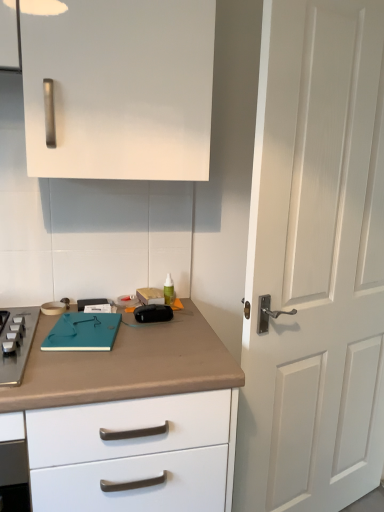
Question: Is brown matte countertop at lower left further to camera compared to teal matte notebook at center?

Choices:
 (A) yes
 (B) no

Answer: (B)

Question: Can you confirm if brown matte countertop at lower left is positioned to the left of teal matte notebook at center?

Choices:
 (A) yes
 (B) no

Answer: (B)

Question: Can you confirm if brown matte countertop at lower left is bigger than teal matte notebook at center?

Choices:
 (A) yes
 (B) no

Answer: (A)

Question: Considering the relative sizes of brown matte countertop at lower left and teal matte notebook at center in the image provided, is brown matte countertop at lower left wider than teal matte notebook at center?

Choices:
 (A) yes
 (B) no

Answer: (A)

Question: Considering the relative positions of brown matte countertop at lower left and teal matte notebook at center in the image provided, is brown matte countertop at lower left to the right of teal matte notebook at center from the viewer's perspective?

Choices:
 (A) yes
 (B) no

Answer: (A)

Question: Is brown matte countertop at lower left in contact with teal matte notebook at center?

Choices:
 (A) no
 (B) yes

Answer: (A)

Question: Is white matte door at right further to camera compared to teal matte notebook at center?

Choices:
 (A) yes
 (B) no

Answer: (B)

Question: Would you say teal matte notebook at center is part of white matte door at right's contents?

Choices:
 (A) no
 (B) yes

Answer: (A)

Question: Can you confirm if white matte door at right is positioned to the left of teal matte notebook at center?

Choices:
 (A) no
 (B) yes

Answer: (A)

Question: Can you confirm if white matte door at right is bigger than teal matte notebook at center?

Choices:
 (A) yes
 (B) no

Answer: (A)

Question: Is white matte door at right placed right next to teal matte notebook at center?

Choices:
 (A) yes
 (B) no

Answer: (B)

Question: From the image's perspective, is white matte door at right over teal matte notebook at center?

Choices:
 (A) yes
 (B) no

Answer: (A)

Question: Can you confirm if teal matte notebook at center is thinner than brown matte countertop at lower left?

Choices:
 (A) yes
 (B) no

Answer: (A)